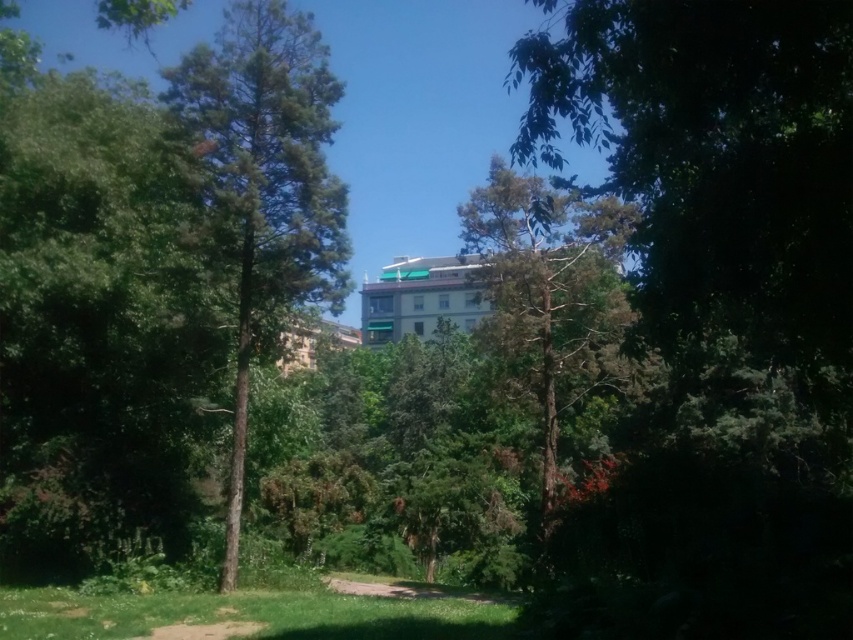
Question: Observing the image, what is the correct spatial positioning of green leafy tree at center in reference to green textured tree at center?

Choices:
 (A) right
 (B) left

Answer: (B)

Question: Does green leafy tree at center have a greater width compared to green textured tree at center?

Choices:
 (A) no
 (B) yes

Answer: (A)

Question: Which of the following is the farthest from the observer?

Choices:
 (A) (323, 256)
 (B) (503, 298)

Answer: (B)

Question: Which point appears closest to the camera in this image?

Choices:
 (A) (210, 60)
 (B) (610, 317)

Answer: (A)

Question: Which object is closer to the camera taking this photo?

Choices:
 (A) green textured tree at center
 (B) green leafy tree at center

Answer: (A)

Question: Can you confirm if green leafy tree at center is positioned above green textured tree at center?

Choices:
 (A) yes
 (B) no

Answer: (A)